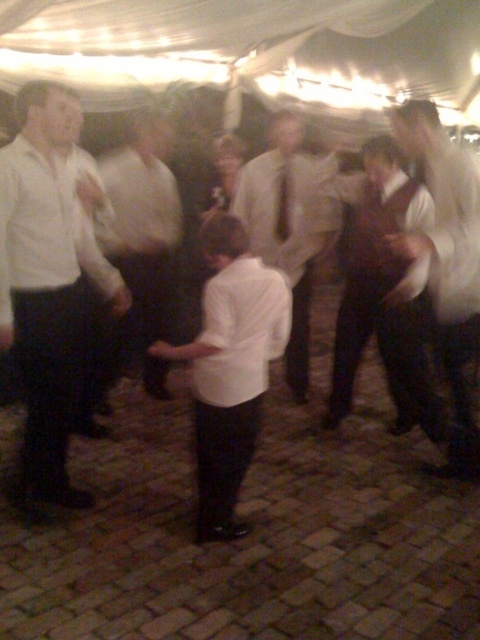
You are a photographer at the event and want to capture both the white shirt at right and the white shirt at center in a single frame. Which one should you focus on first to ensure both are in focus?

You should focus on the white shirt at center first because it is closer to the camera than the white shirt at right, allowing both to be in focus when using a shallow depth of field.